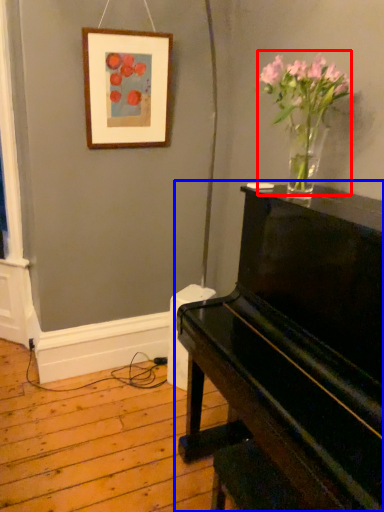
Question: Which object appears closest to the camera in this image, floral arrangement (highlighted by a red box) or piano (highlighted by a blue box)?

Choices:
 (A) floral arrangement
 (B) piano

Answer: (B)